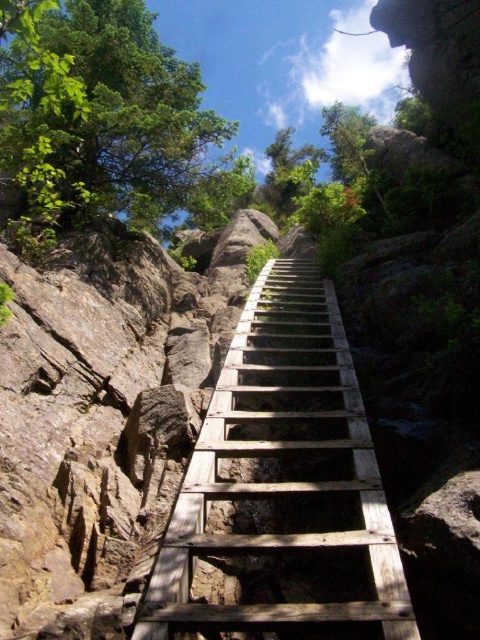
Based on the photo, you are a hiker who needs to reach the green leafy tree at upper left from the weathered wood ladder at center. Can you estimate how far you have to climb in meters?

The distance between the weathered wood ladder at center and the green leafy tree at upper left is 20.86 feet, which converts to approximately 6.36 meters. Therefore, you have to climb about 6.36 meters to reach the green leafy tree at upper left.

You are a hiker trying to navigate the rugged terrain. You see the weathered wood ladder at center and the green leafy tree at upper left. Which object is located higher up in the scene?

The green leafy tree at upper left is higher up in the scene because the weathered wood ladder at center is positioned under it.

You are a hiker planning to climb the wooden ladder between the cliffs. You notice two points marked on the ladder structure. One is at coordinate point (x=310, y=307) and the other at point (x=1, y=44). Which point is closer to you as you start climbing from the bottom?

Point (x=1, y=44) is closer to you as you start climbing from the bottom because it is nearer to the viewer compared to point (x=310, y=307).